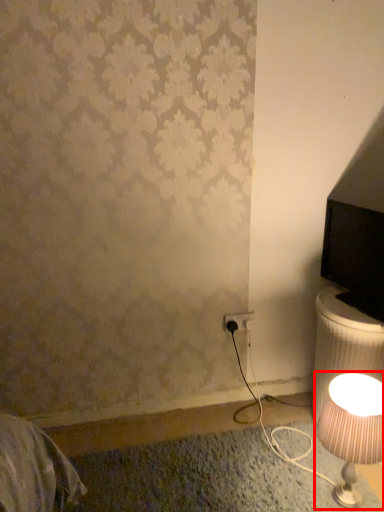
Question: Where is lamp (annotated by the red box) located in relation to electric outlet in the image?

Choices:
 (A) right
 (B) left

Answer: (A)